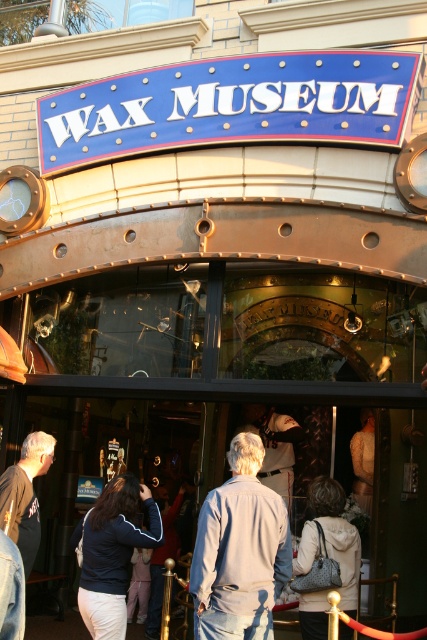
You are a visitor at the wax museum entrance and notice two jackets displayed at the center. Which jacket is positioned higher between the light gray denim jacket at center and the dark blue jacket at center?

The light gray denim jacket at center is positioned higher than the dark blue jacket at center, as it is located above it.

You are a visitor standing at the entrance of the wax museum. You see two coats displayed inside the entrance area. The first is a dark blue jacket at center and the second is a white textured coat at center. Which one is positioned to the left when viewed from the entrance?

The dark blue jacket at center is positioned to the left of the white textured coat at center when viewed from the entrance.

You are a visitor standing at the entrance of the wax museum. You see a light gray denim jacket at center and a white textured coat at center. Which one is closer to you?

The light gray denim jacket at center is closer to you because it is in front of the white textured coat at center.